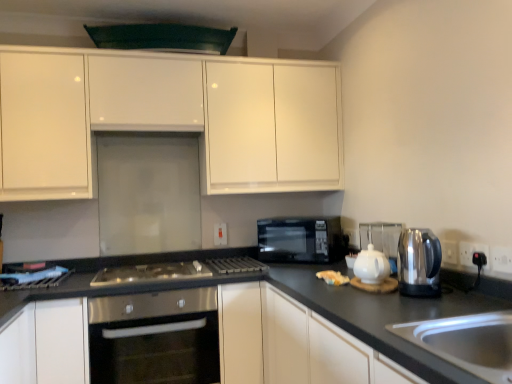
The height and width of the screenshot is (384, 512). Find the location of `vacant space underneath white glossy teapot at center-right (from a real-world perspective)`. vacant space underneath white glossy teapot at center-right (from a real-world perspective) is located at coordinates (376, 285).